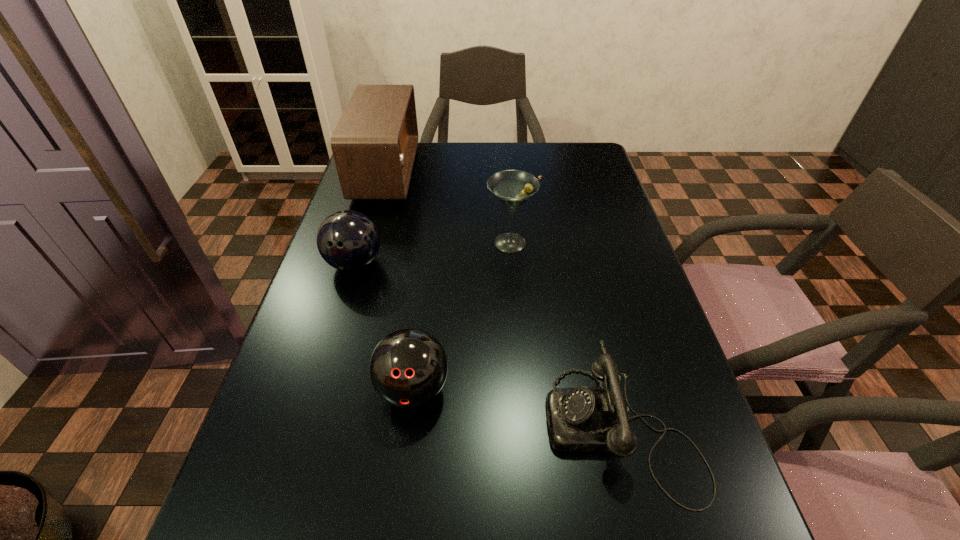
The image size is (960, 540). Identify the location of free spot located on the front-facing side of the telephone. (514, 427).

Find the location of a particular element. This screenshot has height=540, width=960. vacant space located 0.340m on the front-facing side of the telephone is located at coordinates (356, 427).

The image size is (960, 540). I want to click on vacant area situated 0.130m on the front-facing side of the telephone, so click(474, 427).

This screenshot has height=540, width=960. Identify the location of object located in the far edge section of the desktop. (374, 144).

Where is `radio receiver that is at the left edge`? radio receiver that is at the left edge is located at coordinates (374, 144).

Locate an element on the screen. The width and height of the screenshot is (960, 540). bowling ball positioned at the left edge is located at coordinates (347, 240).

Locate an element on the screen. object at the right edge is located at coordinates (580, 419).

Where is `object at the far left corner`? Image resolution: width=960 pixels, height=540 pixels. object at the far left corner is located at coordinates (374, 144).

Locate an element on the screen. The image size is (960, 540). free space at the far edge is located at coordinates (446, 178).

At what (x,y) coordinates should I click in order to perform the action: click on free location at the left edge. Please return your answer as a coordinate pair (x, y). The height and width of the screenshot is (540, 960). Looking at the image, I should click on (371, 317).